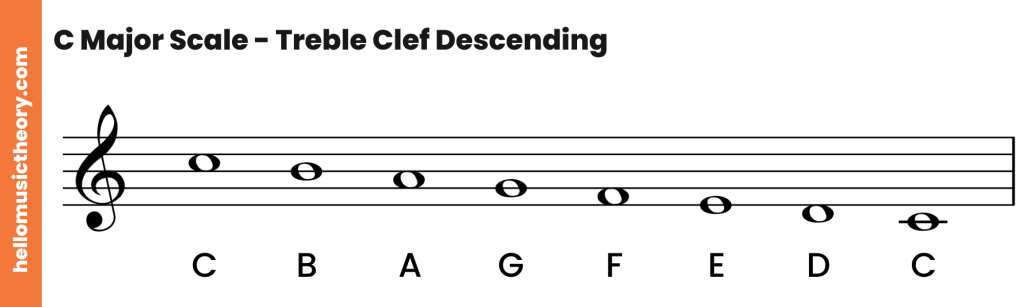
You are a GUI agent. You are given a task and a screenshot of the screen. Output one action in this format:
    pyautogui.click(x=<x>, y=<y>)
    Task: Click on the notes
    The image size is (1024, 307).
    Given the screenshot: What is the action you would take?
    pyautogui.click(x=106, y=163)